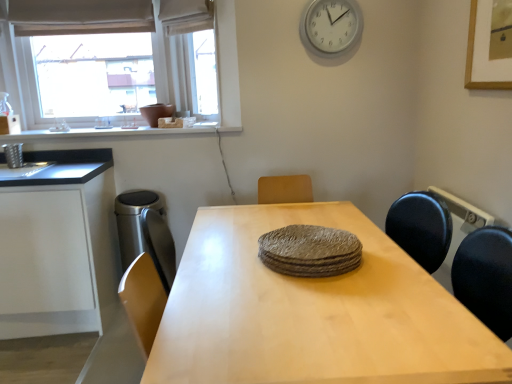
This screenshot has width=512, height=384. What are the coordinates of `vacant area on top of light wood table at center (from a real-world perspective)` in the screenshot? It's located at click(282, 277).